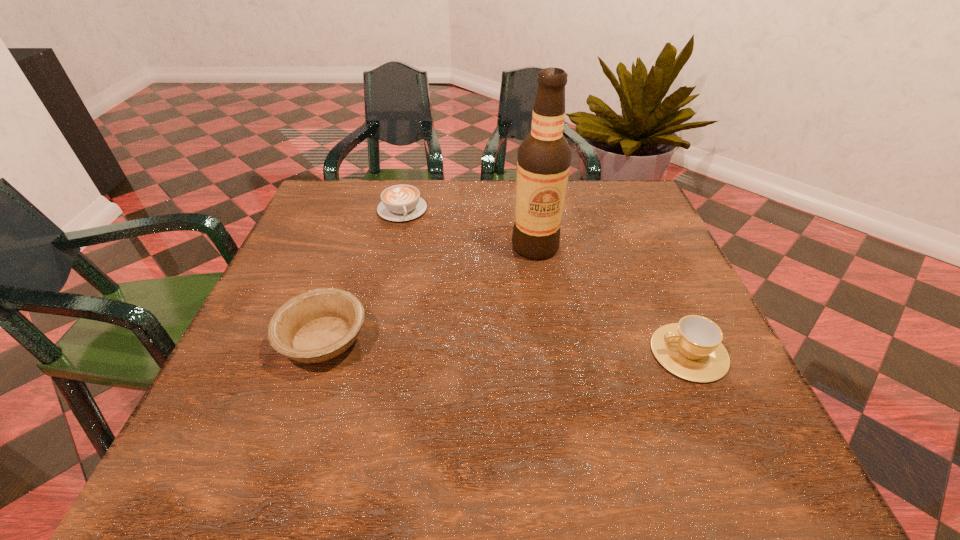
The width and height of the screenshot is (960, 540). Find the location of `object identified as the third closest to the bowl`. object identified as the third closest to the bowl is located at coordinates (691, 349).